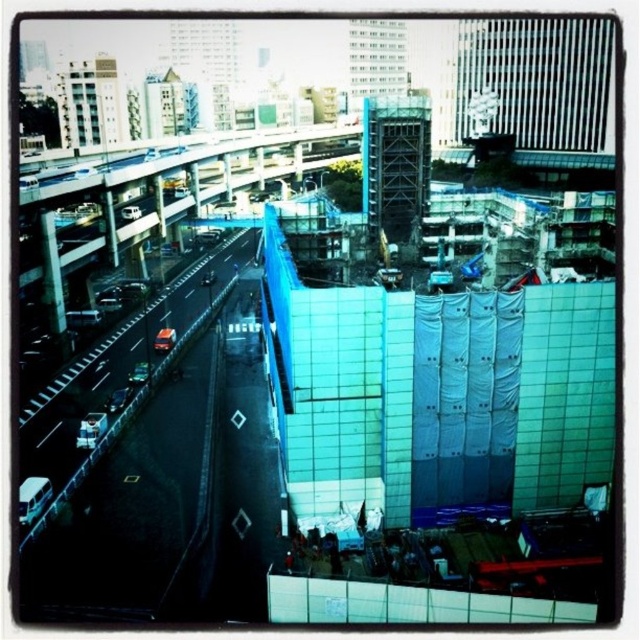
Which is in front, point (164, 541) or point (97, 218)?

Point (164, 541) is more forward.

Who is higher up, black asphalt highway at left or blue glass overpass at center?

Positioned higher is blue glass overpass at center.

At what (x,y) coordinates should I click in order to perform the action: click on black asphalt highway at left. Please return your answer as a coordinate pair (x, y). This screenshot has width=640, height=640. Looking at the image, I should click on (156, 461).

This screenshot has width=640, height=640. In order to click on black asphalt highway at left in this screenshot , I will do `click(156, 461)`.